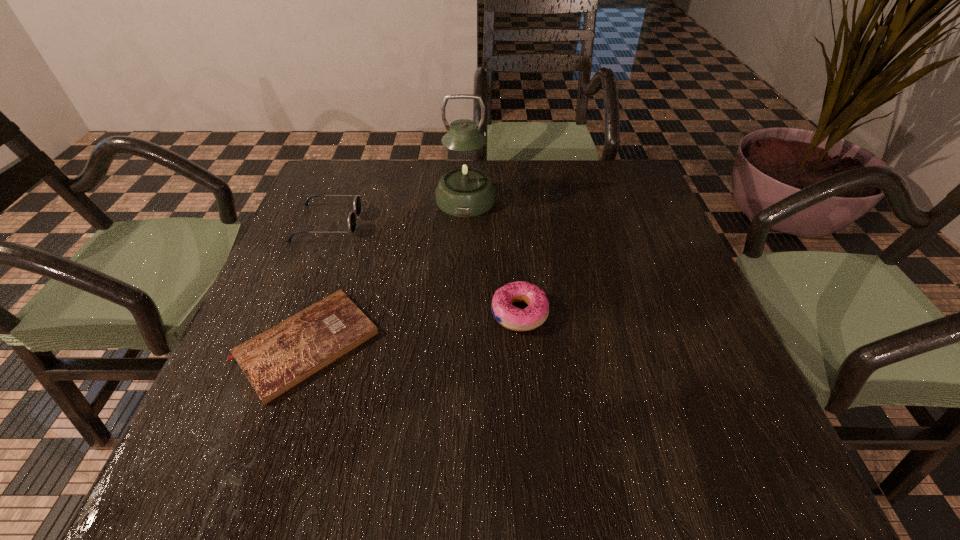
The image size is (960, 540). Find the location of `the tallest object`. the tallest object is located at coordinates (465, 190).

This screenshot has height=540, width=960. Find the location of `sunglasses`. sunglasses is located at coordinates (357, 201).

You are a GUI agent. You are given a task and a screenshot of the screen. Output one action in this format:
    pyautogui.click(x=<x>, y=<y>)
    Task: Click on the doughnut
    
    Given the screenshot: What is the action you would take?
    pyautogui.click(x=513, y=318)

The height and width of the screenshot is (540, 960). I want to click on the shortest object, so click(x=276, y=360).

Find the location of a particular element. The image size is (960, 540). vacant space situated 0.380m on the front of the tallest object is located at coordinates (460, 338).

Identify the location of vacant space located on the front-facing side of the sunglasses. (495, 223).

Find the location of a particular element. Image resolution: width=960 pixels, height=540 pixels. free spot located on the back of the doughnut is located at coordinates (514, 240).

The image size is (960, 540). What are the coordinates of `free space located on the right of the Bible` in the screenshot? It's located at (566, 345).

Identify the location of lantern that is positioned at the far edge. Image resolution: width=960 pixels, height=540 pixels. (465, 190).

Where is `sunglasses that is at the far edge`? This screenshot has width=960, height=540. sunglasses that is at the far edge is located at coordinates (357, 201).